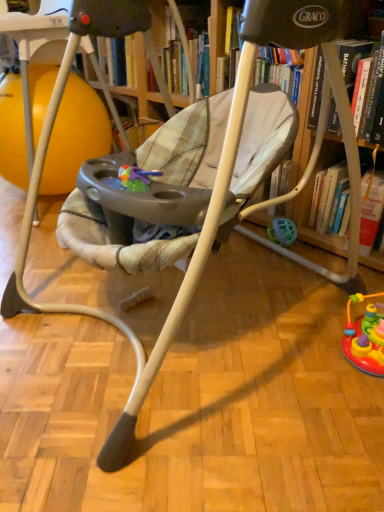
Question: From a real-world perspective, relative to wooden bookshelf at right, is orange rubber ball at left vertically above or below?

Choices:
 (A) below
 (B) above

Answer: (B)

Question: Looking at their shapes, would you say orange rubber ball at left is wider or thinner than wooden bookshelf at right?

Choices:
 (A) thin
 (B) wide

Answer: (B)

Question: Visually, is orange rubber ball at left positioned to the left or to the right of wooden bookshelf at right?

Choices:
 (A) right
 (B) left

Answer: (B)

Question: In the image, is wooden bookshelf at right positioned in front of or behind orange rubber ball at left?

Choices:
 (A) behind
 (B) front

Answer: (B)

Question: From the image's perspective, is wooden bookshelf at right located above or below orange rubber ball at left?

Choices:
 (A) below
 (B) above

Answer: (A)

Question: In terms of height, does wooden bookshelf at right look taller or shorter compared to orange rubber ball at left?

Choices:
 (A) tall
 (B) short

Answer: (B)

Question: Is point (311, 138) closer or farther from the camera than point (51, 190)?

Choices:
 (A) farther
 (B) closer

Answer: (B)